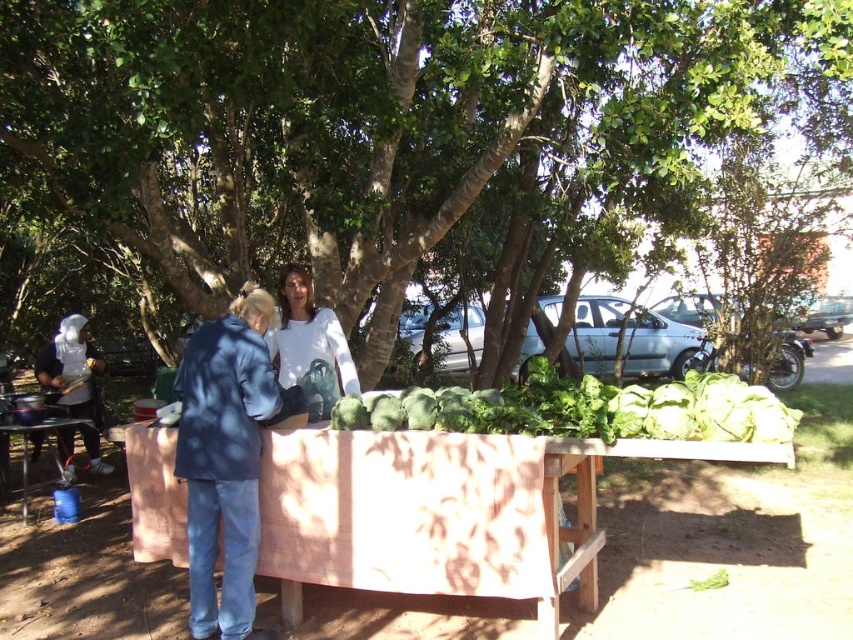
Question: Can you confirm if green leafy tree at center is thinner than white clothed figure at left?

Choices:
 (A) yes
 (B) no

Answer: (B)

Question: Which point appears farthest from the camera in this image?

Choices:
 (A) (427, 547)
 (B) (234, 333)

Answer: (B)

Question: Which of the following is the farthest from the observer?

Choices:
 (A) (314, 387)
 (B) (218, 36)
 (C) (238, 586)
 (D) (305, 579)

Answer: (A)

Question: Can you confirm if green leafy tree at center is thinner than blue plastic bucket at lower left?

Choices:
 (A) no
 (B) yes

Answer: (A)

Question: Does blue denim jacket at lower left come in front of green leafy at center?

Choices:
 (A) no
 (B) yes

Answer: (A)

Question: Which object is closer to the camera taking this photo?

Choices:
 (A) white matte shirt at center
 (B) white clothed figure at left
 (C) green leafy at center
 (D) blue plastic bucket at lower left

Answer: (C)